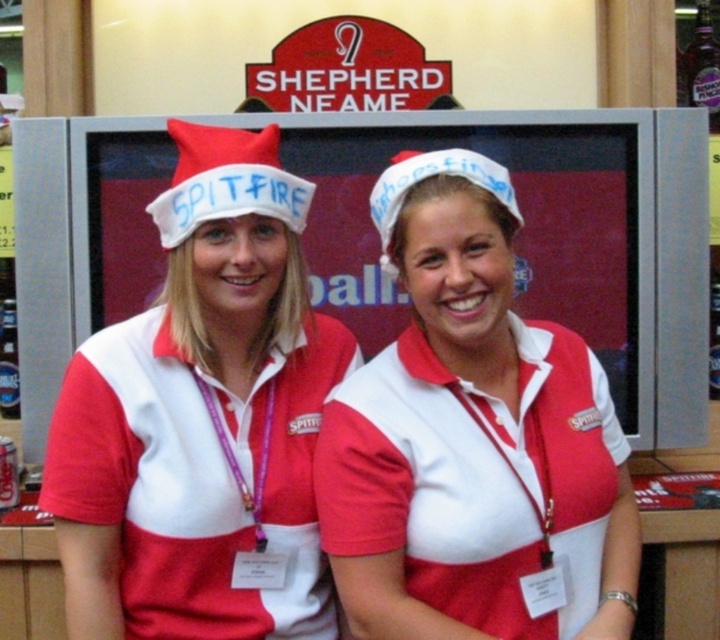
You are organizing a holiday party and need to arrange the decorations. You have a white matte santa hat at center and a red felt santa hat at center. According to the image, which hat should be placed higher up to match the original setup?

The red felt santa hat at center should be placed higher up since the white matte santa hat at center is located below it in the original setup.

What is the color of the hat located at point (202, 419) in the image?

The hat at point (202, 419) is red and white.